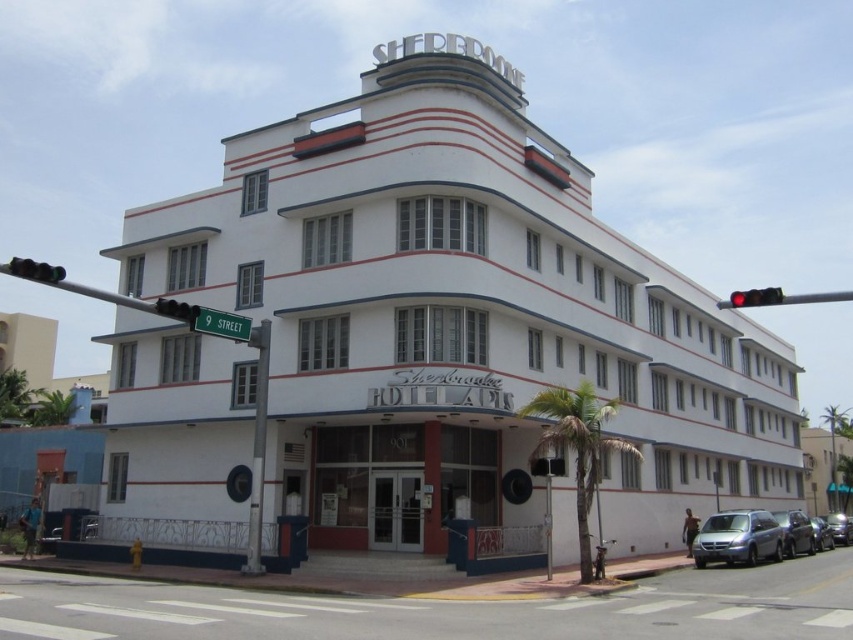
Can you confirm if green metallic street sign at upper center is taller than red glass traffic light at upper left?

Incorrect, green metallic street sign at upper center's height is not larger of red glass traffic light at upper left's.

Can you confirm if green metallic street sign at upper center is thinner than red glass traffic light at upper left?

Correct, green metallic street sign at upper center's width is less than red glass traffic light at upper left's.

What do you see at coordinates (219, 323) in the screenshot? The width and height of the screenshot is (853, 640). I see `green metallic street sign at upper center` at bounding box center [219, 323].

Identify the location of green metallic street sign at upper center. (219, 323).

Is white smooth building at center behind shiny silver sedan at center?

No, white smooth building at center is in front of shiny silver sedan at center.

Who is positioned more to the right, white smooth building at center or shiny silver sedan at center?

Positioned to the right is shiny silver sedan at center.

The image size is (853, 640). Find the location of `white smooth building at center`. white smooth building at center is located at coordinates (460, 314).

Between silver metallic minivan at lower right and green glass traffic light at upper left, which one is positioned lower?

silver metallic minivan at lower right is lower down.

Is point (709, 557) behind point (30, 259)?

That is False.

I want to click on silver metallic minivan at lower right, so click(x=737, y=538).